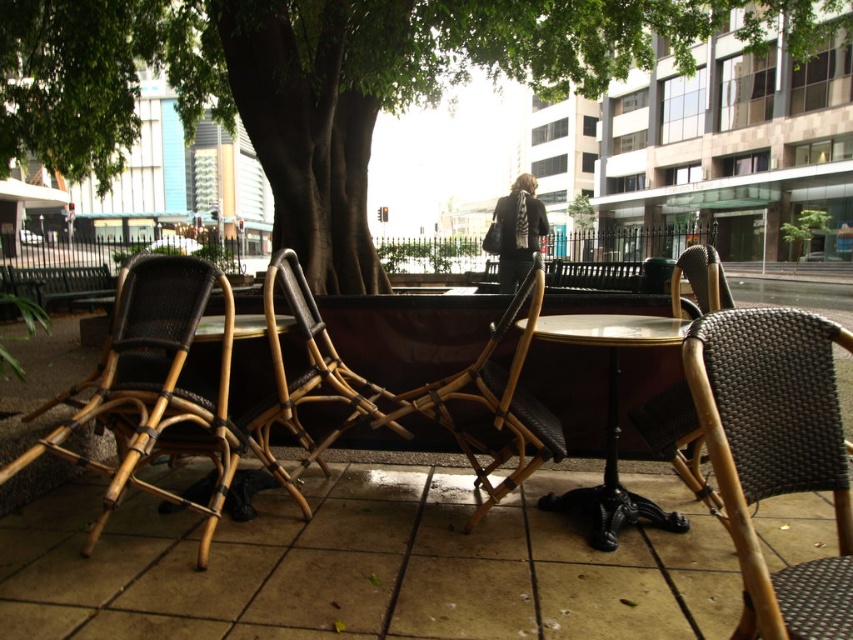
Does green wicker chair at center lie in front of bamboo wicker chair at center?

No, green wicker chair at center is further to the viewer.

Locate an element on the screen. The height and width of the screenshot is (640, 853). green wicker chair at center is located at coordinates (329, 81).

Between green wicker chair at center and woven rattan chair at right, which one appears on the left side from the viewer's perspective?

From the viewer's perspective, woven rattan chair at right appears more on the left side.

Locate an element on the screen. green wicker chair at center is located at coordinates (329, 81).

The image size is (853, 640). I want to click on green wicker chair at center, so click(x=329, y=81).

Describe the element at coordinates (367, 566) in the screenshot. I see `brown tile pavement at center` at that location.

Where is `brown tile pavement at center`? The image size is (853, 640). brown tile pavement at center is located at coordinates (367, 566).